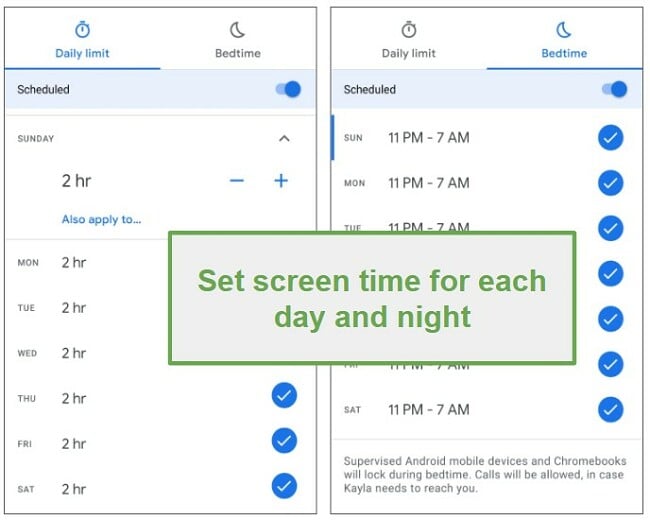
At what (x,y) coordinates should I click in order to perform the action: click on screen. Please return your answer as a coordinate pair (x, y). This screenshot has width=650, height=520. Looking at the image, I should click on (254, 281).